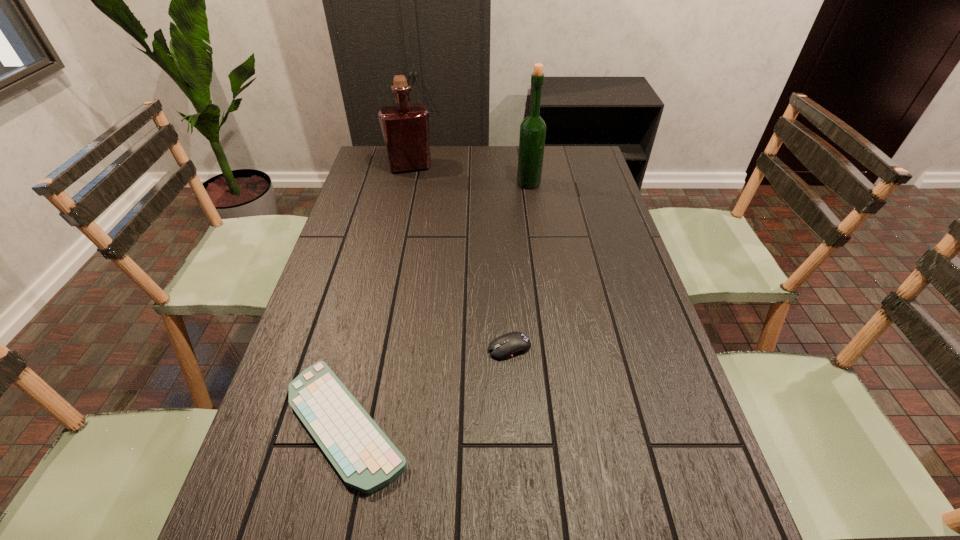
The width and height of the screenshot is (960, 540). Find the location of `free space between the third nearest object and the shorter liquor`. free space between the third nearest object and the shorter liquor is located at coordinates (469, 175).

Locate an element on the screen. unoccupied position between the farther liquor and the second object from right to left is located at coordinates (460, 257).

Where is `vacant space in between the second shortest object and the shortest object`? Image resolution: width=960 pixels, height=540 pixels. vacant space in between the second shortest object and the shortest object is located at coordinates (428, 386).

Find the location of `blank region between the second nearest object and the nearest object`. blank region between the second nearest object and the nearest object is located at coordinates (428, 386).

Locate an element on the screen. free space that is in between the computer equipment and the farthest object is located at coordinates (460, 257).

Image resolution: width=960 pixels, height=540 pixels. I want to click on vacant space that is in between the tallest object and the computer equipment, so click(519, 266).

Locate an element on the screen. This screenshot has height=540, width=960. free spot between the shorter liquor and the third farthest object is located at coordinates (460, 257).

Image resolution: width=960 pixels, height=540 pixels. In order to click on free space between the shortest object and the farthest object in this screenshot , I will do `click(378, 295)`.

The width and height of the screenshot is (960, 540). I want to click on free space between the computer keyboard and the second nearest object, so [x=428, y=386].

This screenshot has height=540, width=960. I want to click on vacant region between the computer keyboard and the farther liquor, so click(378, 295).